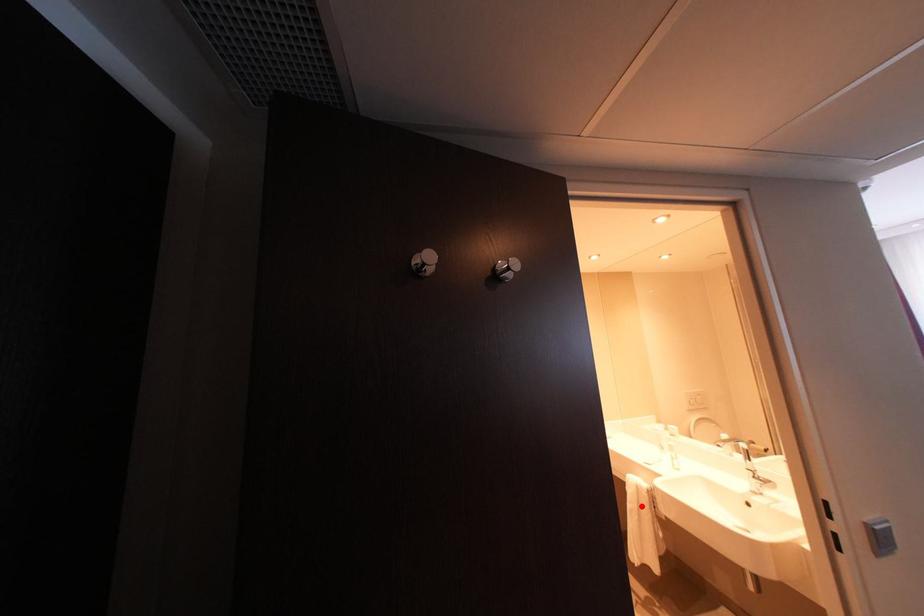
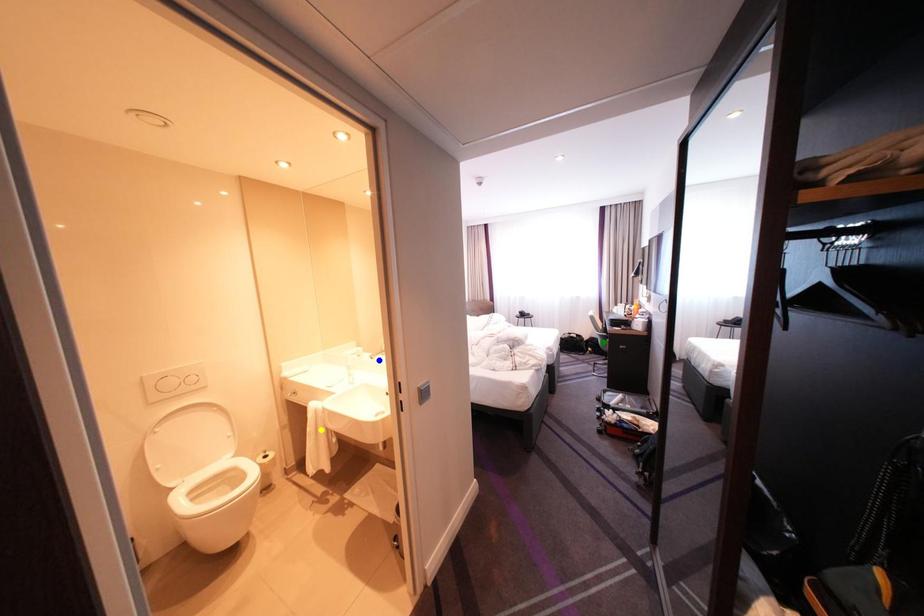
Question: I am providing you with two images of the same scene from different viewpoints. A red point is marked on the first image. You are given multiple points on the second image. Can you choose the point in image 2 that corresponds to the point in image 1?

Choices:
 (A) yellow point
 (B) blue point
 (C) green point

Answer: (A)